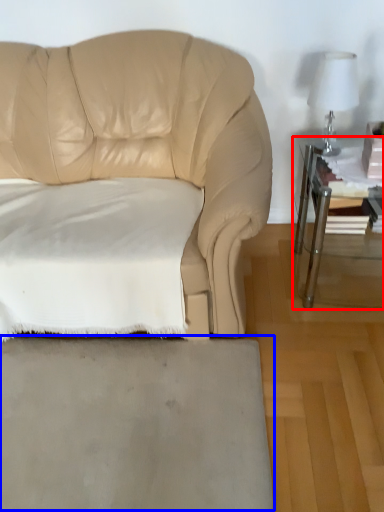
Question: Which point is closer to the camera, table (highlighted by a red box) or concrete (highlighted by a blue box)?

Choices:
 (A) table
 (B) concrete

Answer: (B)